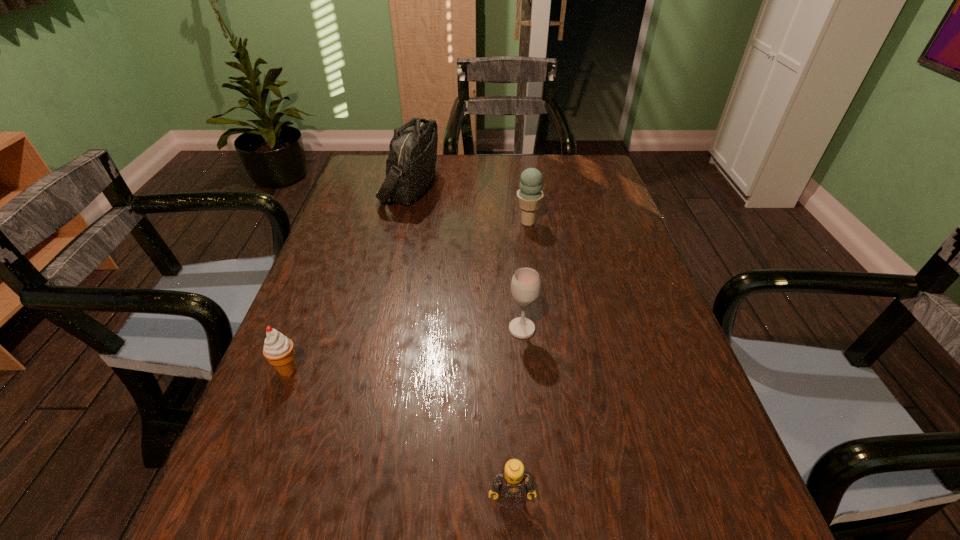
Image resolution: width=960 pixels, height=540 pixels. I want to click on the farthest object, so click(x=410, y=166).

Where is `shoulder bag`? The width and height of the screenshot is (960, 540). shoulder bag is located at coordinates (410, 166).

The height and width of the screenshot is (540, 960). I want to click on the right icecream, so click(530, 194).

Locate an element on the screen. The width and height of the screenshot is (960, 540). the taller icecream is located at coordinates (530, 194).

At what (x,y) coordinates should I click in order to perform the action: click on the third farthest object. Please return your answer as a coordinate pair (x, y). The image size is (960, 540). Looking at the image, I should click on (525, 286).

The image size is (960, 540). I want to click on the leftmost object, so click(x=278, y=349).

Identify the location of the nearer icecream. The image size is (960, 540). (278, 349).

Find the location of `the nearest object`. the nearest object is located at coordinates [513, 484].

Where is `vacant space located 0.120m at the front padded panel of the fourth object from right to left`? The height and width of the screenshot is (540, 960). vacant space located 0.120m at the front padded panel of the fourth object from right to left is located at coordinates (476, 185).

The width and height of the screenshot is (960, 540). In order to click on free region located 0.330m on the front of the fourth nearest object in this screenshot , I will do `click(540, 318)`.